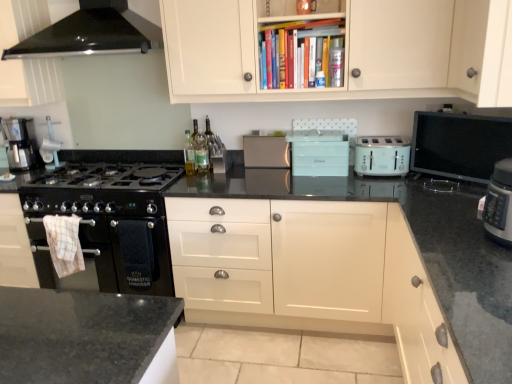
I want to click on vacant space situated above satin silver toaster at center, arranged as the 3th appliance when viewed from the right (from a real-world perspective), so click(266, 132).